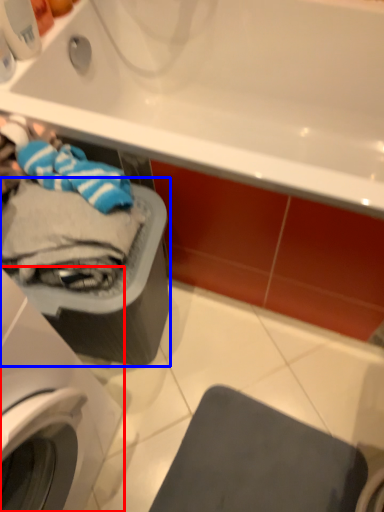
Question: Which of the following is the closest to the observer, washing machine (highlighted by a red box) or dish washer (highlighted by a blue box)?

Choices:
 (A) washing machine
 (B) dish washer

Answer: (A)